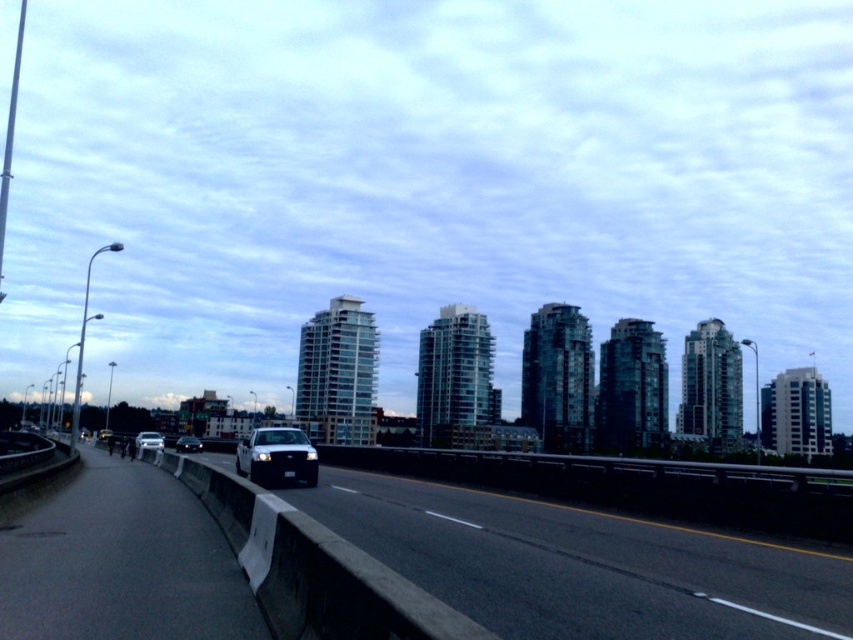
You are standing at the point labeled as point (682, 602) on the highway. You want to cross the road to reach the sidewalk on the left. Considering the distance between you and the nearest streetlight, can you safely cross the road before the black vehicle arrives?

The distance between you and the viewer is 23.36 feet. Since the black vehicle is in the center lane, it would need to travel past the concrete barrier and the distance between you and the viewer to reach your location. However, without knowing the vehicle speed or the exact position of the streetlights, it is impossible to determine safety. Please wait for a safe opportunity to cross.

You are a driver approaching the highway and see both the shiny white sedan at center and the black glossy sedan at center. Which one appears larger to you?

The shiny white sedan at center appears larger than the black glossy sedan at center.

You are a driver approaching the black asphalt highway at center and the black glossy sedan at center. Which one takes up more visual space in the image?

The black glossy sedan at center takes up more visual space than the black asphalt highway at center because the black asphalt highway at center occupies less space than black glossy sedan at center.